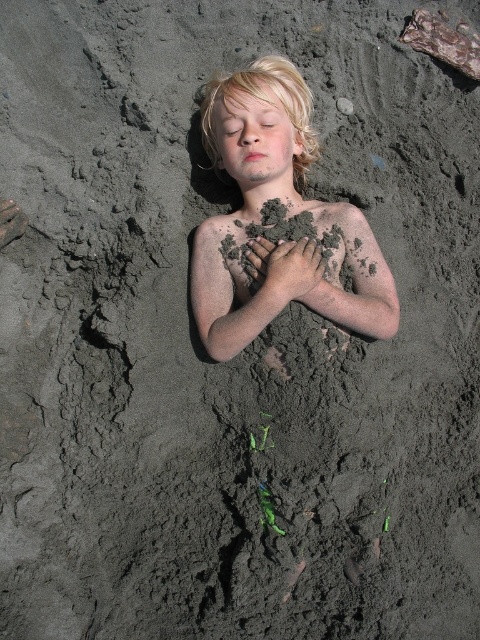
Does matte sand child at center have a greater width compared to dark brown mud hand at center?

Yes.

Which is in front, point (372, 264) or point (266, 280)?

Point (266, 280) is more forward.

Image resolution: width=480 pixels, height=640 pixels. Find the location of `matte sand child at center`. matte sand child at center is located at coordinates (288, 212).